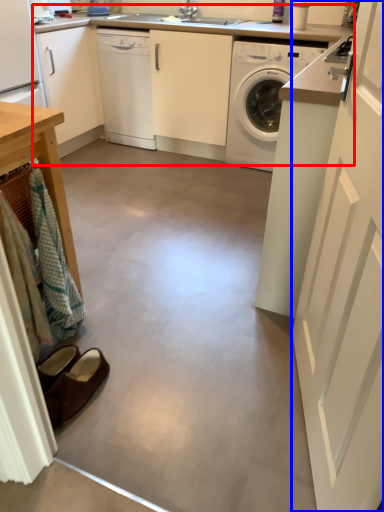
Question: Which object appears farthest to the camera in this image, counter top (highlighted by a red box) or screen door (highlighted by a blue box)?

Choices:
 (A) counter top
 (B) screen door

Answer: (A)